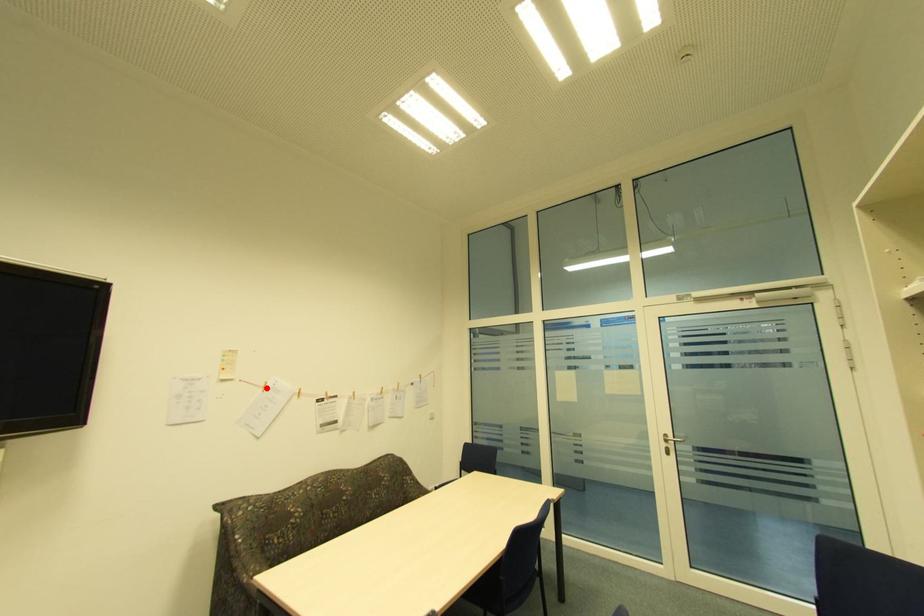
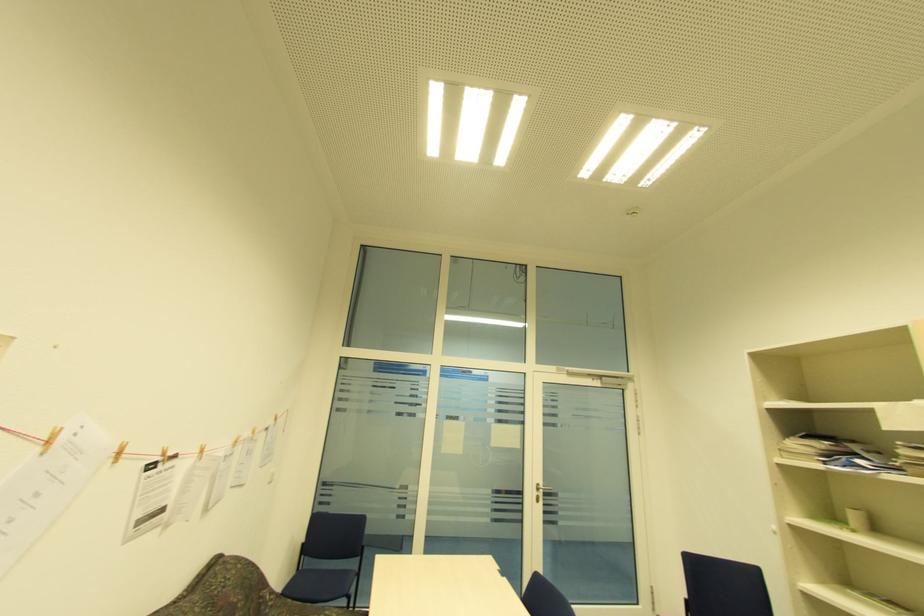
Find the pixel in the second image that matches the highlighted location in the first image.

(51, 444)